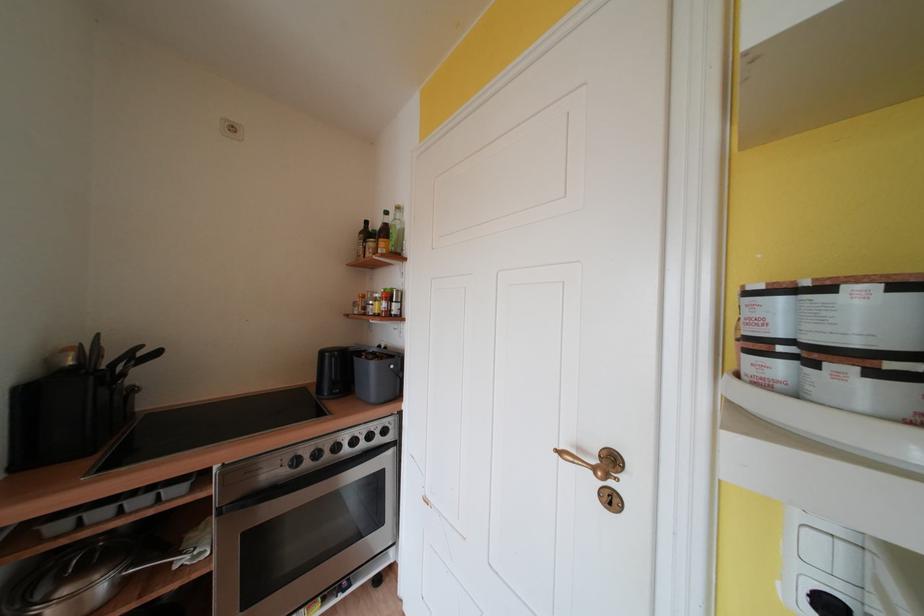
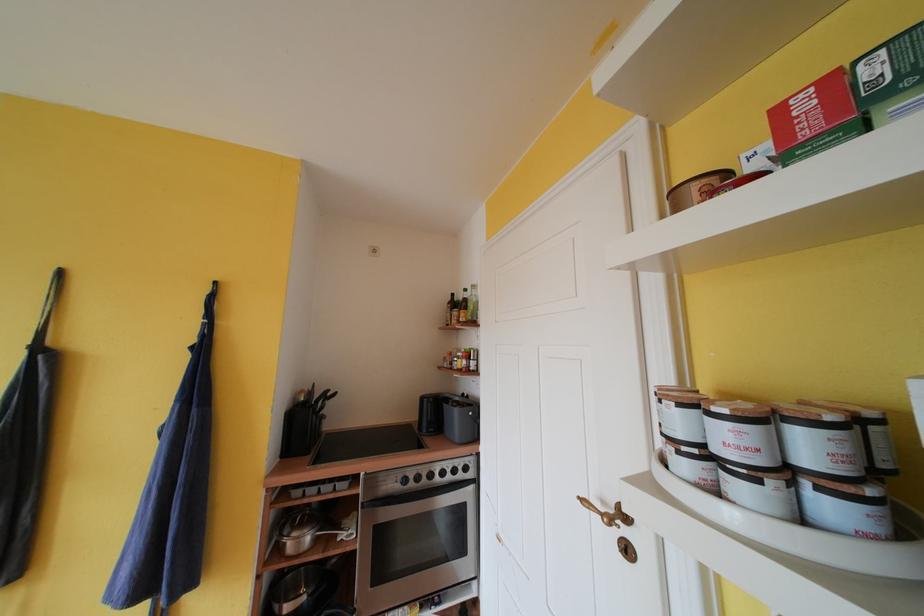
Where in the second image is the point corresponding to point (600, 472) from the first image?

(609, 519)